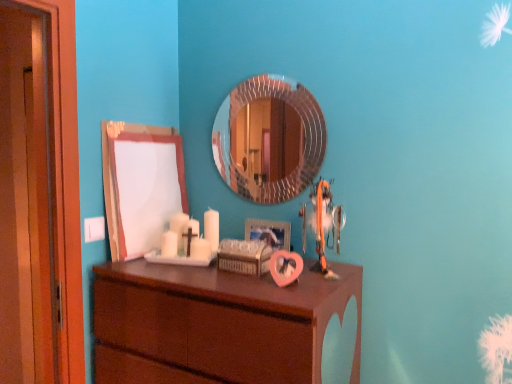
What do you see at coordinates (325, 225) in the screenshot?
I see `orange fabric toy at center` at bounding box center [325, 225].

I want to click on brown wood chest of drawers at center, so (215, 324).

Considering the sizes of objects wooden picture frame at center and rounded silver mirror at center, the second mirror positioned from the left, in the image provided, who is bigger, wooden picture frame at center or rounded silver mirror at center, the second mirror positioned from the left,?

With larger size is rounded silver mirror at center, the second mirror positioned from the left.

Considering the relative sizes of wooden picture frame at center and rounded silver mirror at center, the 1th mirror viewed from the right, in the image provided, is wooden picture frame at center taller than rounded silver mirror at center, the 1th mirror viewed from the right,?

No, wooden picture frame at center is not taller than rounded silver mirror at center, the 1th mirror viewed from the right.

Is wooden picture frame at center not within rounded silver mirror at center, the second mirror positioned from the left?

wooden picture frame at center is positioned outside rounded silver mirror at center, the second mirror positioned from the left.

Does wooden picture frame at center have a smaller size compared to white matte board at upper left, which ranks as the second mirror in right-to-left order?

Indeed, wooden picture frame at center has a smaller size compared to white matte board at upper left, which ranks as the second mirror in right-to-left order.

What's the angular difference between wooden picture frame at center and white matte board at upper left, which is the first mirror from left to right,'s facing directions?

90.1 degrees separate the facing orientations of wooden picture frame at center and white matte board at upper left, which is the first mirror from left to right.

Can white matte board at upper left, which is the first mirror from left to right, be found inside wooden picture frame at center?

No, white matte board at upper left, which is the first mirror from left to right, is not a part of wooden picture frame at center.

Between wooden picture frame at center and white matte board at upper left, which is the first mirror from left to right, which one has less height?

wooden picture frame at center.

Is wooden picture frame at center with brown wood chest of drawers at center?

No, wooden picture frame at center is not beside brown wood chest of drawers at center.

You are a GUI agent. You are given a task and a screenshot of the screen. Output one action in this format:
    pyautogui.click(x=<x>, y=<y>)
    Task: Click on the picture frame on the right of brown wood chest of drawers at center
    This screenshot has width=512, height=384.
    Given the screenshot: What is the action you would take?
    pyautogui.click(x=269, y=232)

Which object is further away from the camera, wooden picture frame at center or brown wood chest of drawers at center?

wooden picture frame at center is further away from the camera.

Is wooden picture frame at center taller than brown wood chest of drawers at center?

Incorrect, the height of wooden picture frame at center is not larger of that of brown wood chest of drawers at center.

Which is more to the left, brown wood chest of drawers at center or wooden picture frame at center?

From the viewer's perspective, brown wood chest of drawers at center appears more on the left side.

Between brown wood chest of drawers at center and wooden picture frame at center, which one has larger size?

brown wood chest of drawers at center is bigger.

Considering the relative sizes of brown wood chest of drawers at center and wooden picture frame at center in the image provided, is brown wood chest of drawers at center thinner than wooden picture frame at center?

Incorrect, the width of brown wood chest of drawers at center is not less than that of wooden picture frame at center.

Measure the distance from brown wood chest of drawers at center to wooden picture frame at center.

brown wood chest of drawers at center is 39.12 centimeters from wooden picture frame at center.

How distant is white matte board at upper left, which ranks as the second mirror in right-to-left order, from wooden picture frame at center?

A distance of 17.89 inches exists between white matte board at upper left, which ranks as the second mirror in right-to-left order, and wooden picture frame at center.

From a real-world perspective, is white matte board at upper left, which ranks as the second mirror in right-to-left order, above or below wooden picture frame at center?

white matte board at upper left, which ranks as the second mirror in right-to-left order, is above wooden picture frame at center.

What are the coordinates of `picture frame behind the white matte board at upper left, which ranks as the second mirror in right-to-left order` in the screenshot? It's located at (269, 232).

From the picture: From the image's perspective, would you say white matte board at upper left, which is the first mirror from left to right, is shown under wooden picture frame at center?

No, from the image's perspective, white matte board at upper left, which is the first mirror from left to right, is not beneath wooden picture frame at center.

From the image's perspective, which one is positioned higher, orange fabric toy at center or brown wood chest of drawers at center?

orange fabric toy at center.

I want to click on the chest of drawers in front of the orange fabric toy at center, so click(215, 324).

Considering the positions of objects orange fabric toy at center and brown wood chest of drawers at center in the image provided, who is more to the right, orange fabric toy at center or brown wood chest of drawers at center?

orange fabric toy at center is more to the right.

Between point (301, 211) and point (282, 313), which one is positioned in front?

The point (282, 313) is closer.

Looking at the image, does rounded silver mirror at center, the 1th mirror viewed from the right, seem bigger or smaller compared to orange fabric toy at center?

In the image, rounded silver mirror at center, the 1th mirror viewed from the right, appears to be smaller than orange fabric toy at center.

I want to click on mirror that is the 2nd one when counting upward from the orange fabric toy at center (from the image's perspective), so click(269, 139).

Could you tell me if rounded silver mirror at center, the 1th mirror viewed from the right, is facing orange fabric toy at center?

Yes, rounded silver mirror at center, the 1th mirror viewed from the right, is aimed at orange fabric toy at center.

Is rounded silver mirror at center, the second mirror positioned from the left, wider or thinner than orange fabric toy at center?

In the image, rounded silver mirror at center, the second mirror positioned from the left, appears to be more narrow than orange fabric toy at center.

From the wooden picture frame at center, count 1st mirrors forward and point to it. Please provide its 2D coordinates.

[(269, 139)]

From the image's perspective, which mirror is the 1st one above the wooden picture frame at center? Please provide its 2D coordinates.

[(141, 185)]

From the image, which object appears to be nearer to orange fabric toy at center, white matte board at upper left, which is the first mirror from left to right, or rounded silver mirror at center, the 1th mirror viewed from the right?

rounded silver mirror at center, the 1th mirror viewed from the right.

Estimate the real-world distances between objects in this image. Which object is closer to brown wood chest of drawers at center, wooden picture frame at center or orange fabric toy at center?

orange fabric toy at center is positioned closer to the anchor brown wood chest of drawers at center.

When comparing their distances from wooden picture frame at center, does brown wood chest of drawers at center or orange fabric toy at center seem closer?

orange fabric toy at center is closer to wooden picture frame at center.

From the image, which object appears to be farther from white matte board at upper left, which is the first mirror from left to right, rounded silver mirror at center, the 1th mirror viewed from the right, or wooden picture frame at center?

wooden picture frame at center lies further to white matte board at upper left, which is the first mirror from left to right, than the other object.

Looking at the image, which one is located further to orange fabric toy at center, wooden picture frame at center or brown wood chest of drawers at center?

brown wood chest of drawers at center is positioned further to the anchor orange fabric toy at center.

Which object lies nearer to the anchor point white matte board at upper left, which ranks as the second mirror in right-to-left order, orange fabric toy at center or rounded silver mirror at center, the second mirror positioned from the left?

rounded silver mirror at center, the second mirror positioned from the left.

Consider the image. Which object lies nearer to the anchor point wooden picture frame at center, rounded silver mirror at center, the second mirror positioned from the left, or orange fabric toy at center?

orange fabric toy at center lies closer to wooden picture frame at center than the other object.

Estimate the real-world distances between objects in this image. Which object is further from orange fabric toy at center, brown wood chest of drawers at center or wooden picture frame at center?

The object further to orange fabric toy at center is brown wood chest of drawers at center.

Find the location of `picture frame that lies between orange fabric toy at center and brown wood chest of drawers at center from top to bottom`. picture frame that lies between orange fabric toy at center and brown wood chest of drawers at center from top to bottom is located at coordinates [x=269, y=232].

You are a GUI agent. You are given a task and a screenshot of the screen. Output one action in this format:
    pyautogui.click(x=<x>, y=<y>)
    Task: Click on the picture frame between rounded silver mirror at center, the 1th mirror viewed from the right, and brown wood chest of drawers at center from top to bottom
    
    Given the screenshot: What is the action you would take?
    coord(269,232)

Where is `toy between white matte board at upper left, which ranks as the second mirror in right-to-left order, and brown wood chest of drawers at center in the up-down direction`? The height and width of the screenshot is (384, 512). toy between white matte board at upper left, which ranks as the second mirror in right-to-left order, and brown wood chest of drawers at center in the up-down direction is located at coordinates (325, 225).

Identify the location of toy between rounded silver mirror at center, the 1th mirror viewed from the right, and wooden picture frame at center in the up-down direction. (325, 225).